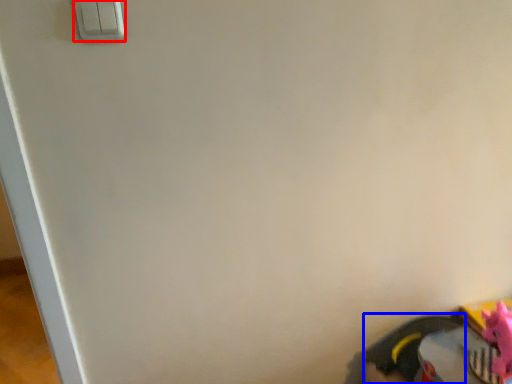
Question: Which point is closer to the camera, light switch (highlighted by a red box) or footwear (highlighted by a blue box)?

Choices:
 (A) light switch
 (B) footwear

Answer: (A)